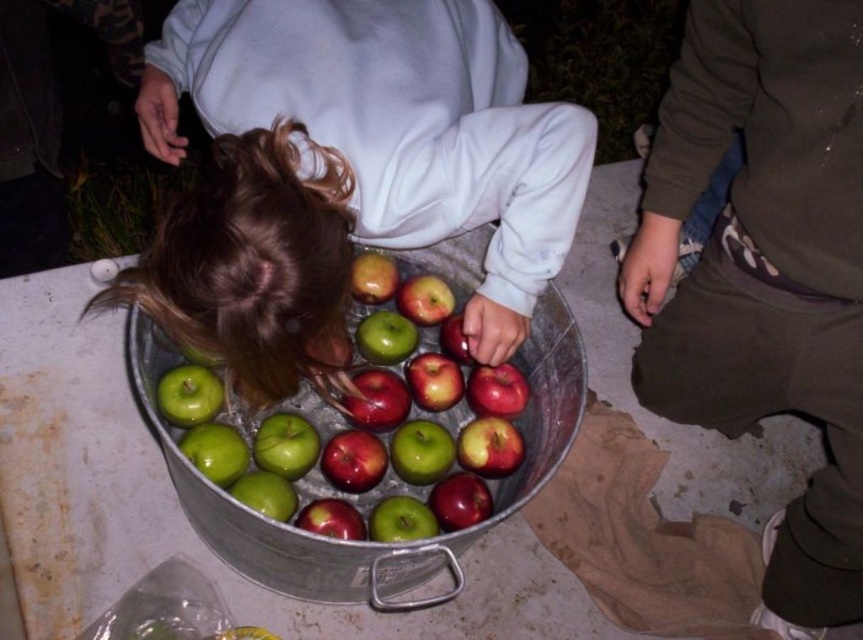
You are standing in front of the bucket and want to reach two points marked on the bucket. The first point is at coordinate point (191, 193) and the second is at point (666, 330). Which point will be easier to reach without moving your position?

Point (191, 193) is closer to the camera than point (666, 330), so it will be easier to reach without moving your position.

You are a photographer trying to capture the child and the green shiny apple at center. Since the dark green pants at lower right are blocking the view, can you move to the left to get a better shot?

The dark green pants at lower right is positioned on the right side of green shiny apple at center, so moving to the left would allow you to avoid the obstruction and capture the green shiny apple at center without the dark green pants at lower right blocking the view.

You are a parent trying to ensure your child stays safe while playing near the bucket. Based on the scene, how far apart are the smooth green apples at center and the dark green pants at lower right?

The smooth green apples at center and the dark green pants at lower right are 56.27 centimeters apart from each other.